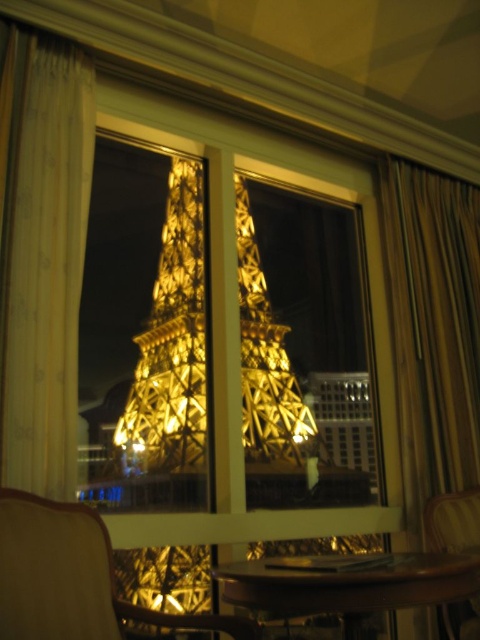
Can you confirm if white sheer curtain at left is shorter than gold metallic eiffel tower at center?

Indeed, white sheer curtain at left has a lesser height compared to gold metallic eiffel tower at center.

Is white sheer curtain at left smaller than gold metallic eiffel tower at center?

Correct, white sheer curtain at left occupies less space than gold metallic eiffel tower at center.

The image size is (480, 640). What do you see at coordinates (46, 272) in the screenshot?
I see `white sheer curtain at left` at bounding box center [46, 272].

At what (x,y) coordinates should I click in order to perform the action: click on white sheer curtain at left. Please return your answer as a coordinate pair (x, y). This screenshot has height=640, width=480. Looking at the image, I should click on (46, 272).

Who is more distant from viewer, [1,528] or [228,570]?

Positioned behind is point [228,570].

Can you confirm if wooden armchair at lower left is positioned to the right of wooden table at center?

Incorrect, wooden armchair at lower left is not on the right side of wooden table at center.

Image resolution: width=480 pixels, height=640 pixels. What are the coordinates of `wooden armchair at lower left` in the screenshot? It's located at (72, 577).

Where is `wooden armchair at lower left`? The height and width of the screenshot is (640, 480). wooden armchair at lower left is located at coordinates (72, 577).

Does gold fabric curtain at right appear on the right side of wooden table at center?

Indeed, gold fabric curtain at right is positioned on the right side of wooden table at center.

Is gold fabric curtain at right to the left of wooden table at center from the viewer's perspective?

In fact, gold fabric curtain at right is to the right of wooden table at center.

This screenshot has width=480, height=640. Identify the location of gold fabric curtain at right. (432, 328).